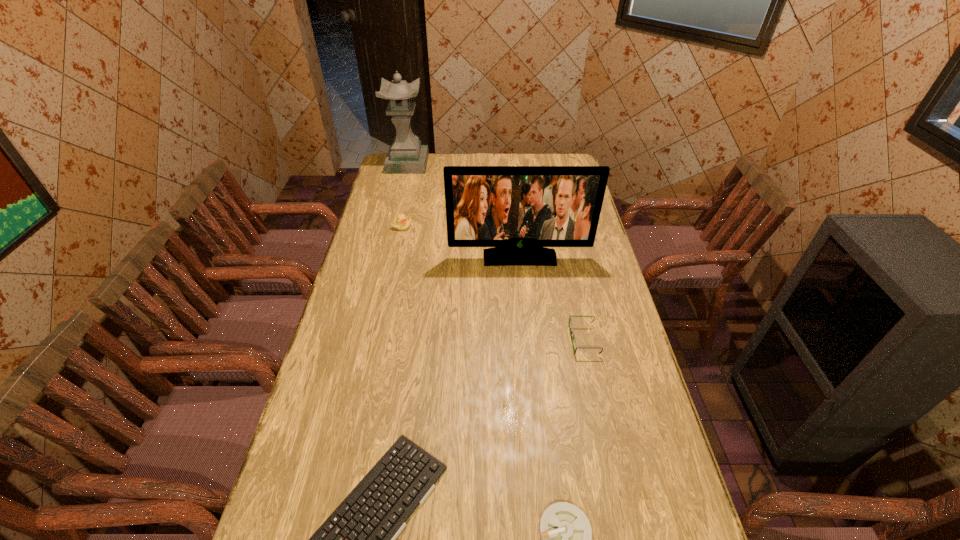
Find the location of `sculpture`. sculpture is located at coordinates (406, 155).

Image resolution: width=960 pixels, height=540 pixels. What are the coordinates of `the third farthest object` in the screenshot? It's located at [518, 210].

At what (x,y) coordinates should I click in order to perform the action: click on monitor. Please return your answer as a coordinate pair (x, y). This screenshot has height=540, width=960. Looking at the image, I should click on (518, 210).

Where is `duckling`? duckling is located at coordinates (401, 222).

Find the location of a particular element. the second farthest object is located at coordinates (401, 222).

At what (x,y) coordinates should I click in order to perform the action: click on spectacles. Please return your answer as a coordinate pair (x, y). Looking at the image, I should click on (570, 319).

This screenshot has height=540, width=960. What are the coordinates of `the fourth farthest object` in the screenshot? It's located at (570, 319).

This screenshot has width=960, height=540. Find the location of `vacant space positioned at the front opening of the sculpture`. vacant space positioned at the front opening of the sculpture is located at coordinates (462, 164).

At what (x,y) coordinates should I click in order to perform the action: click on vacant space situated 0.140m on the front-facing side of the third farthest object. Please return your answer as a coordinate pair (x, y). The height and width of the screenshot is (540, 960). Looking at the image, I should click on (523, 293).

Where is `vacant position located 0.210m on the beak of the third tallest object`? The height and width of the screenshot is (540, 960). vacant position located 0.210m on the beak of the third tallest object is located at coordinates (394, 266).